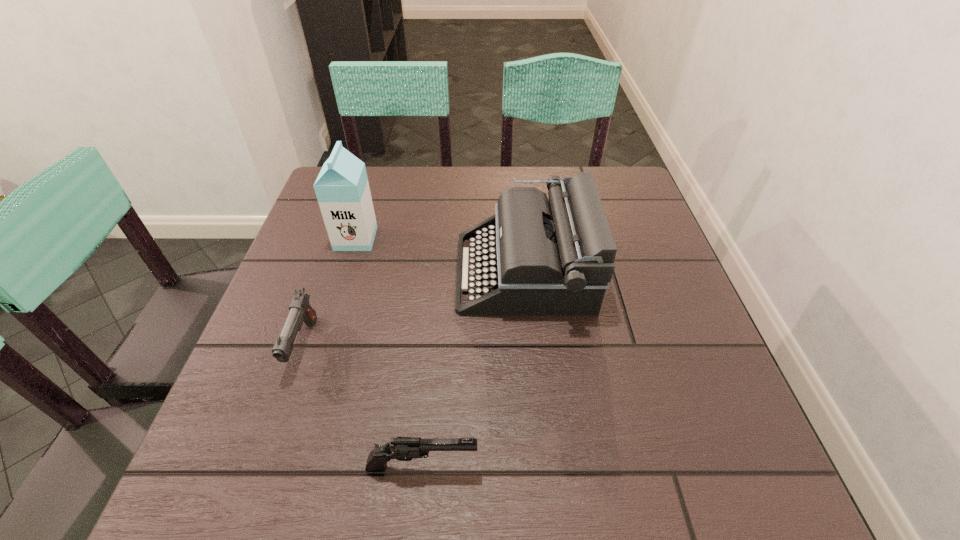
The width and height of the screenshot is (960, 540). I want to click on vacant space that is in between the left gun and the typewriter, so coord(414,309).

Where is `object that is the third closest to the right gun`? The width and height of the screenshot is (960, 540). object that is the third closest to the right gun is located at coordinates 342,189.

Locate an element on the screen. The width and height of the screenshot is (960, 540). object that stands as the second closest to the left gun is located at coordinates (401, 448).

At what (x,y) coordinates should I click in order to perform the action: click on free point that satisfies the following two spatial constraints: 1. on the typing side of the third shortest object; 2. in the direction the farther gun is aimed. Please return your answer as a coordinate pair (x, y). Looking at the image, I should click on (531, 346).